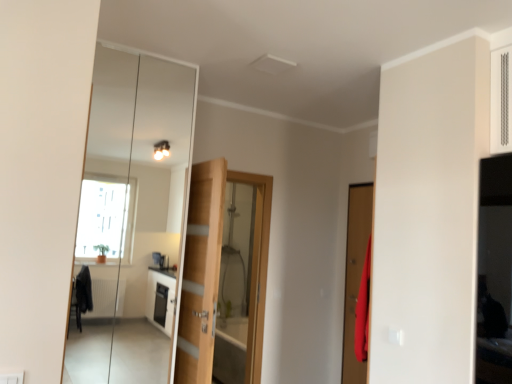
Question: From the image's perspective, is clear glass mirror at center above matte wooden door at right, which is the 1th door from front to back?

Choices:
 (A) no
 (B) yes

Answer: (B)

Question: From the image's perspective, is clear glass mirror at center beneath matte wooden door at right, which is counted as the first door, starting from the right?

Choices:
 (A) no
 (B) yes

Answer: (A)

Question: Can you confirm if clear glass mirror at center is thinner than matte wooden door at right, which is counted as the second door, starting from the back?

Choices:
 (A) yes
 (B) no

Answer: (B)

Question: From a real-world perspective, is clear glass mirror at center over matte wooden door at right, which is the 1th door from front to back?

Choices:
 (A) no
 (B) yes

Answer: (B)

Question: Is clear glass mirror at center not near matte wooden door at right, which is the 1th door from front to back?

Choices:
 (A) no
 (B) yes

Answer: (B)

Question: Relative to wooden door at center, the 2th door from the front, is matte wooden door at right, which is counted as the first door, starting from the right, in front or behind?

Choices:
 (A) front
 (B) behind

Answer: (A)

Question: From their relative heights in the image, would you say matte wooden door at right, which is the 1th door from front to back, is taller or shorter than wooden door at center, the 2th door from the front?

Choices:
 (A) short
 (B) tall

Answer: (A)

Question: Looking at their shapes, would you say matte wooden door at right, which is the 1th door from front to back, is wider or thinner than wooden door at center, positioned as the 2th door in right-to-left order?

Choices:
 (A) wide
 (B) thin

Answer: (A)

Question: Considering the positions of matte wooden door at right, which is the 1th door from front to back, and wooden door at center, positioned as the 2th door in right-to-left order, in the image, is matte wooden door at right, which is the 1th door from front to back, bigger or smaller than wooden door at center, positioned as the 2th door in right-to-left order,?

Choices:
 (A) small
 (B) big

Answer: (A)

Question: From the image's perspective, is wooden door at center, placed as the first door when sorted from left to right, above or below clear glass mirror at center?

Choices:
 (A) below
 (B) above

Answer: (A)

Question: Would you say wooden door at center, placed as the first door when sorted from left to right, is inside or outside clear glass mirror at center?

Choices:
 (A) outside
 (B) inside

Answer: (A)

Question: From their relative heights in the image, would you say wooden door at center, placed as the first door when sorted from left to right, is taller or shorter than clear glass mirror at center?

Choices:
 (A) short
 (B) tall

Answer: (A)

Question: Does point (197, 218) appear closer or farther from the camera than point (111, 67)?

Choices:
 (A) closer
 (B) farther

Answer: (A)

Question: Relative to matte wooden door at right, which is counted as the first door, starting from the right, is clear glass mirror at center in front or behind?

Choices:
 (A) front
 (B) behind

Answer: (A)

Question: Considering the positions of clear glass mirror at center and matte wooden door at right, which is the 1th door from front to back, in the image, is clear glass mirror at center wider or thinner than matte wooden door at right, which is the 1th door from front to back,?

Choices:
 (A) wide
 (B) thin

Answer: (A)